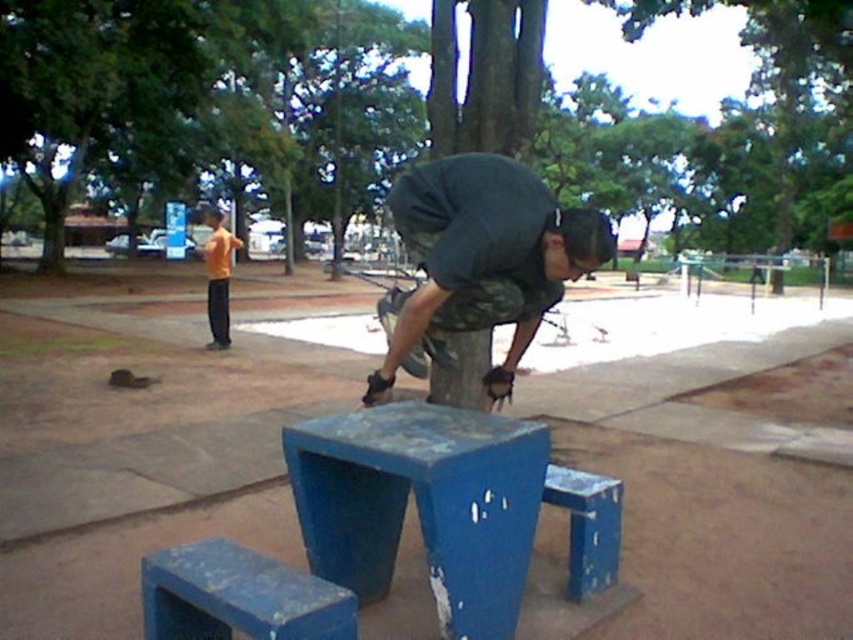
From the picture: You are a park visitor who wants to find the person wearing the orange shirt at left. According to the scene, where should you look relative to the camouflage pants at center?

The orange shirt at left is located to the left of the camouflage pants at center.

You are a painter who needs to paint both the blue painted wood step stool at lower center and the blue painted wood step stool at lower right. Which stool requires more paint because of its size?

The blue painted wood step stool at lower center requires more paint because its width is larger than the blue painted wood step stool at lower right.